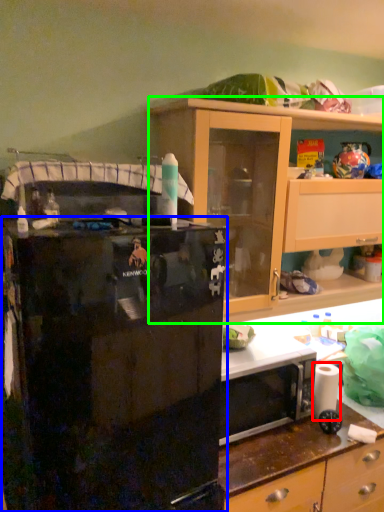
Question: Which object is the farthest from toilet paper (highlighted by a red box)? Choose among these: refrigerator (highlighted by a blue box) or cabinetry (highlighted by a green box).

Choices:
 (A) refrigerator
 (B) cabinetry

Answer: (A)